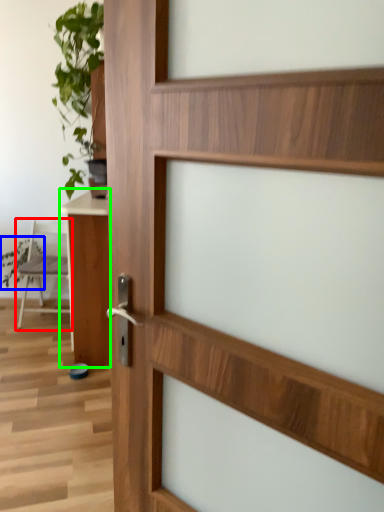
Question: Based on their relative distances, which object is nearer to chair (highlighted by a red box)? Choose from plant (highlighted by a blue box) and table (highlighted by a green box).

Choices:
 (A) plant
 (B) table

Answer: (A)